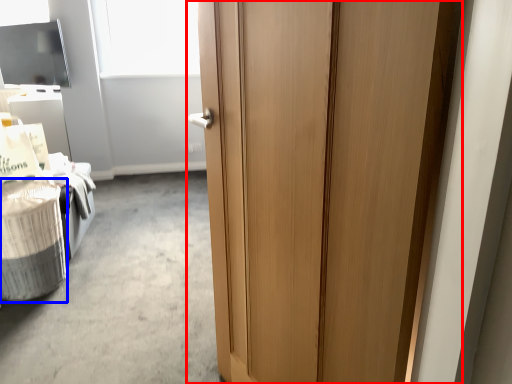
Question: Which object appears closest to the camera in this image, door (highlighted by a red box) or laundry basket (highlighted by a blue box)?

Choices:
 (A) door
 (B) laundry basket

Answer: (A)